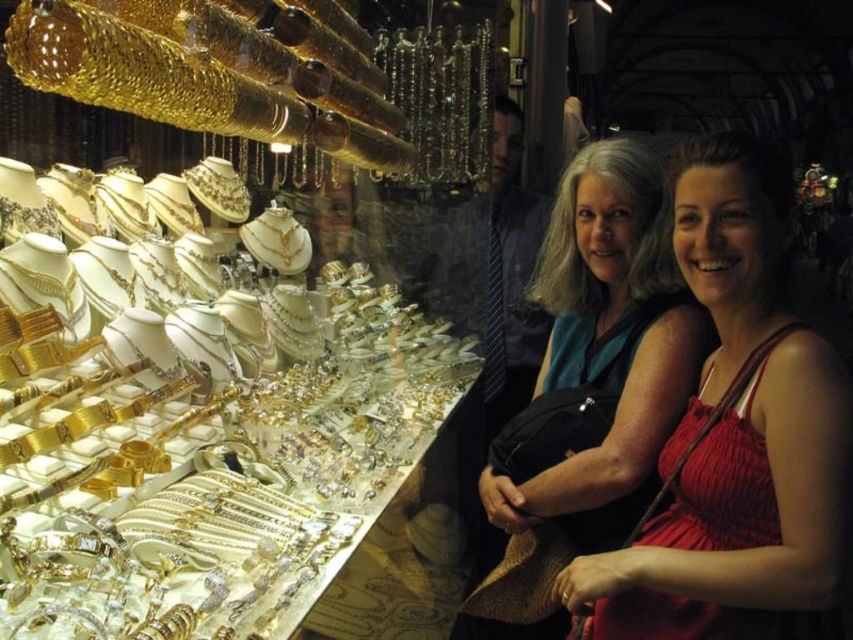
You are a customer in the jewelry store and want to examine the gold shiny jewelry at left and the matte red dress at center. Which object is nearer to you when you first enter the store?

The gold shiny jewelry at left is closer to the viewer than the matte red dress at center, so it is nearer when you first enter the store.

You are a customer in the jewelry store and want to find the gold shiny jewelry at left. According to the store layout, where should you look?

The gold shiny jewelry at left is located at point (202, 429), so you should look there.

You are a customer in a jewelry store and want to locate the gold shiny jewelry at left. According to the coordinates provided, where should you look in the image?

The gold shiny jewelry at left is located at coordinates point (202, 429) in the image.